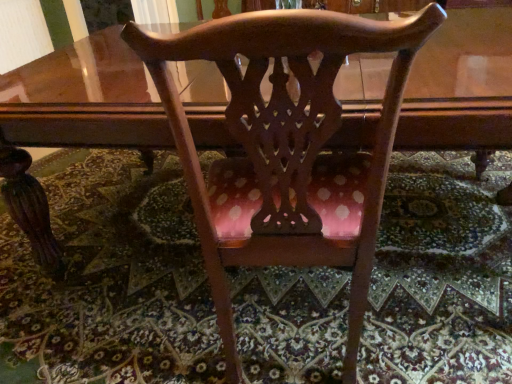
Question: From the image's perspective, is carpeted floor at center above or below polished wood chair at center?

Choices:
 (A) below
 (B) above

Answer: (A)

Question: Is carpeted floor at center wider or thinner than polished wood chair at center?

Choices:
 (A) wide
 (B) thin

Answer: (A)

Question: Would you say carpeted floor at center is to the left or to the right of polished wood chair at center in the picture?

Choices:
 (A) right
 (B) left

Answer: (B)

Question: Considering the positions of polished wood chair at center and carpeted floor at center in the image, is polished wood chair at center taller or shorter than carpeted floor at center?

Choices:
 (A) tall
 (B) short

Answer: (A)

Question: Considering the positions of polished wood chair at center and carpeted floor at center in the image, is polished wood chair at center bigger or smaller than carpeted floor at center?

Choices:
 (A) big
 (B) small

Answer: (A)

Question: Is polished wood chair at center to the left or to the right of carpeted floor at center in the image?

Choices:
 (A) right
 (B) left

Answer: (A)

Question: Looking at their shapes, would you say polished wood chair at center is wider or thinner than carpeted floor at center?

Choices:
 (A) thin
 (B) wide

Answer: (A)